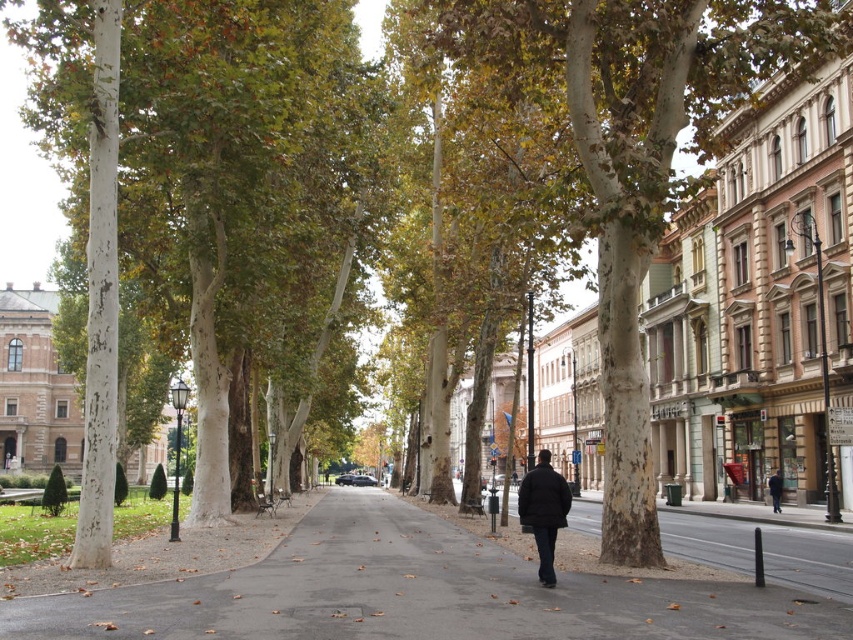
You are a pedestrian standing on the street in the image. You see a smooth bark tree at center and a black matte coat at center. Which object is bigger in size?

The smooth bark tree at center has a larger size compared to the black matte coat at center.

You are standing at the point with coordinates point [540,536] and want to walk towards the point with coordinates point [770,488]. Given the urban street scene described, will you have to walk through any obstacles like trees or buildings along the way?

Point [540,536] is in front of point [770,488], so you would be walking towards the point [770,488] from a position closer to the viewer. Since the trees are on the left side of the image and the buildings are on the right, the path between the two points likely lies in the middle of the road where there are no trees or buildings obstructing the path. Therefore, you can walk directly from point [540,536] to point [770,488] without encountering obstacles.